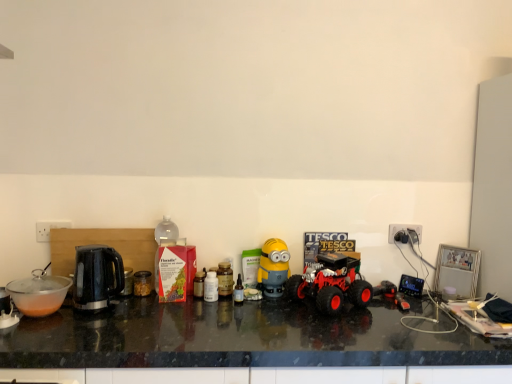
This screenshot has height=384, width=512. In order to click on vacant space to the left of white plastic bottle at center, arranged as the 1th bottle when viewed from the left in this screenshot , I will do `click(166, 306)`.